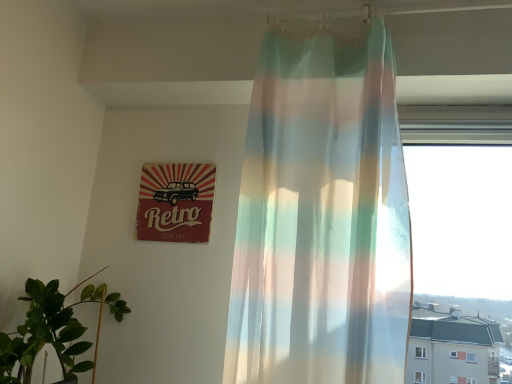
Question: Does green leafy plant at lower left come in front of retro paper sign at upper left?

Choices:
 (A) no
 (B) yes

Answer: (B)

Question: Considering the relative sizes of green leafy plant at lower left and retro paper sign at upper left in the image provided, is green leafy plant at lower left smaller than retro paper sign at upper left?

Choices:
 (A) yes
 (B) no

Answer: (B)

Question: Is green leafy plant at lower left next to retro paper sign at upper left and touching it?

Choices:
 (A) no
 (B) yes

Answer: (A)

Question: From the image's perspective, is green leafy plant at lower left under retro paper sign at upper left?

Choices:
 (A) no
 (B) yes

Answer: (B)

Question: Does green leafy plant at lower left have a greater width compared to retro paper sign at upper left?

Choices:
 (A) no
 (B) yes

Answer: (B)

Question: Does green leafy plant at lower left appear on the right side of retro paper sign at upper left?

Choices:
 (A) yes
 (B) no

Answer: (B)

Question: From a real-world perspective, is retro paper sign at upper left physically above translucent pastel curtain at center?

Choices:
 (A) yes
 (B) no

Answer: (A)

Question: Does retro paper sign at upper left appear on the left side of translucent pastel curtain at center?

Choices:
 (A) yes
 (B) no

Answer: (A)

Question: Considering the relative sizes of retro paper sign at upper left and translucent pastel curtain at center in the image provided, is retro paper sign at upper left smaller than translucent pastel curtain at center?

Choices:
 (A) no
 (B) yes

Answer: (B)

Question: From the image's perspective, is retro paper sign at upper left over translucent pastel curtain at center?

Choices:
 (A) yes
 (B) no

Answer: (B)

Question: Does retro paper sign at upper left have a larger size compared to translucent pastel curtain at center?

Choices:
 (A) no
 (B) yes

Answer: (A)

Question: Can translucent pastel curtain at center be found inside retro paper sign at upper left?

Choices:
 (A) yes
 (B) no

Answer: (B)

Question: Is translucent pastel curtain at center oriented towards retro paper sign at upper left?

Choices:
 (A) no
 (B) yes

Answer: (A)